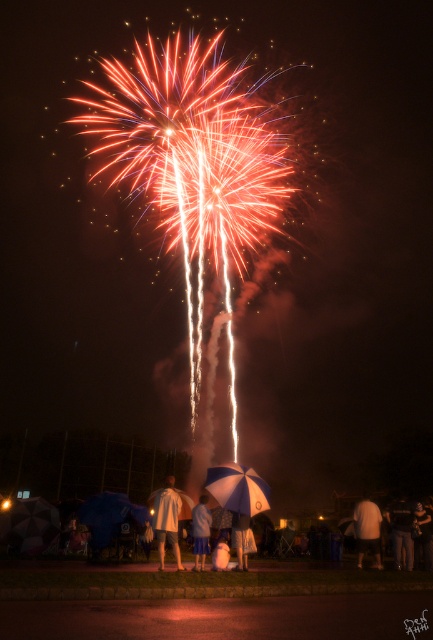
You are at a fireworks show and want to take a photo of the white matte shirt at lower right without the blue matte umbrella at lower center blocking the view. Is this possible from your current position?

The blue matte umbrella at lower center is in front of the white matte shirt at lower right, so it would block the view. To capture the white matte shirt at lower right without obstruction, you would need to move to a position where the blue matte umbrella at lower center is not between you and the shirt.

Based on the photo, you are a photographer trying to capture a clear shot of the fireworks. You notice the blue matte umbrella at lower center and the white matte shirt at lower right are in your frame. Which object is narrower, and should you adjust your camera angle to avoid it?

The blue matte umbrella at lower center is narrower than the white matte shirt at lower right. Since it is narrower, adjusting the camera angle to avoid it might be easier as it takes up less space in the frame.

You are standing at point (419, 508) and want to throw a paper airplane to reach the fireworks explosion at the center. The paper airplane can fly 20 meters. Will it reach?

The distance between you at point (419, 508) and the fireworks explosion at the center is 19.66 meters, so yes, the paper airplane can reach the fireworks explosion at the center since it can fly further than the required distance.